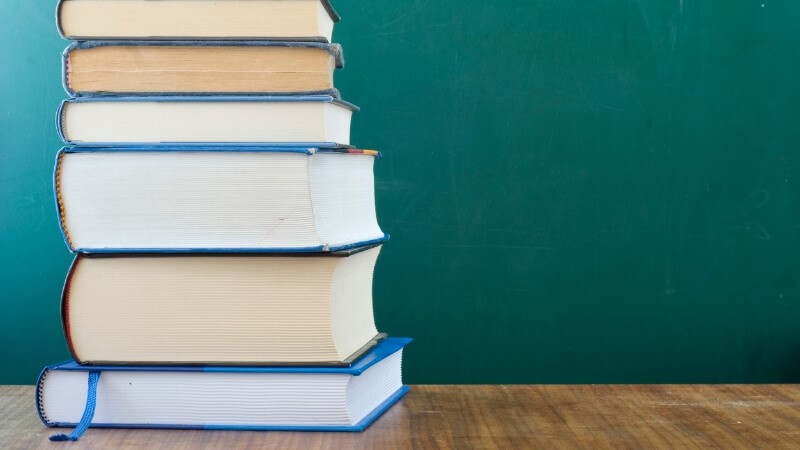
Find the location of a particular element. The image size is (800, 450). horizontal hardcover books is located at coordinates (178, 18), (180, 76), (180, 117), (204, 193), (206, 310), (216, 404).